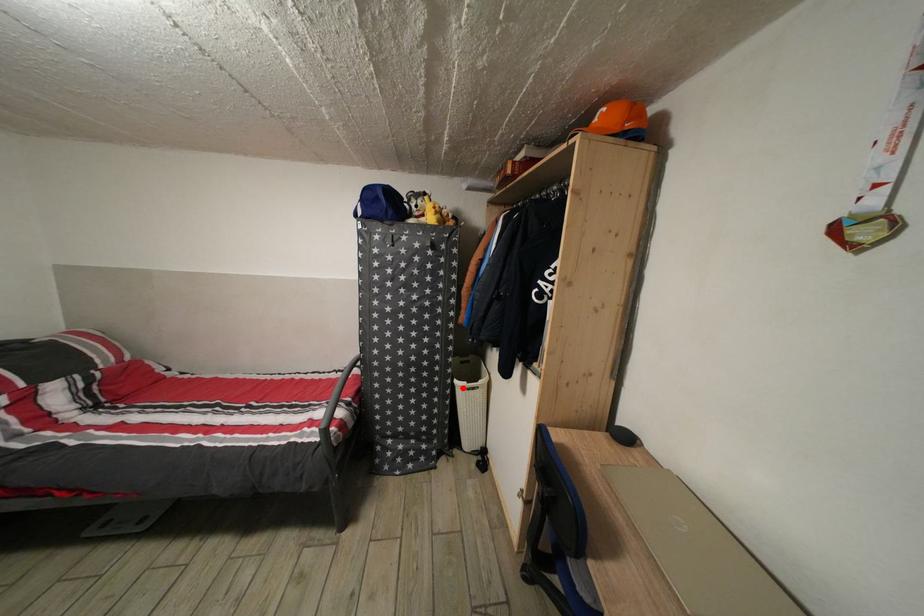
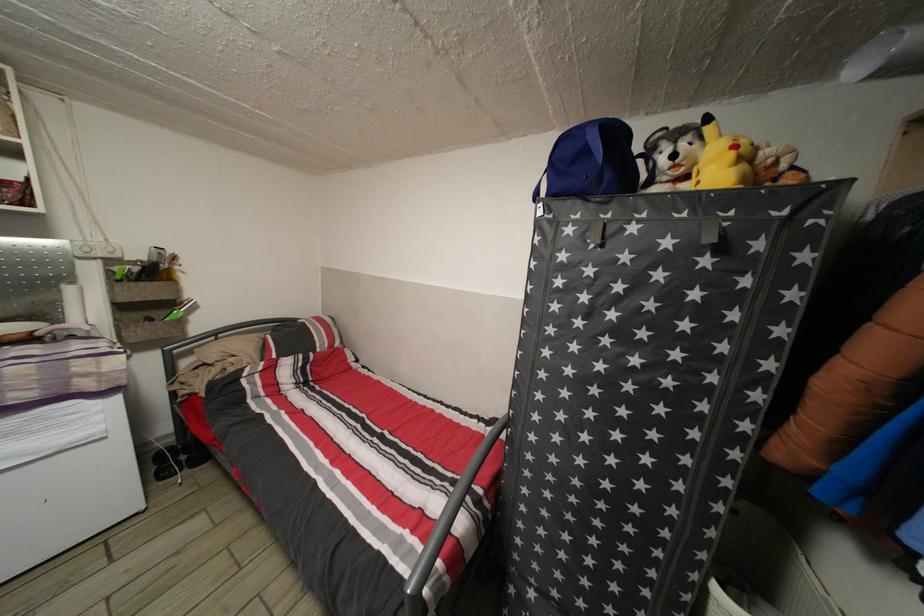
Find the pixel in the second image that matches the highlighted location in the first image.

(723, 594)